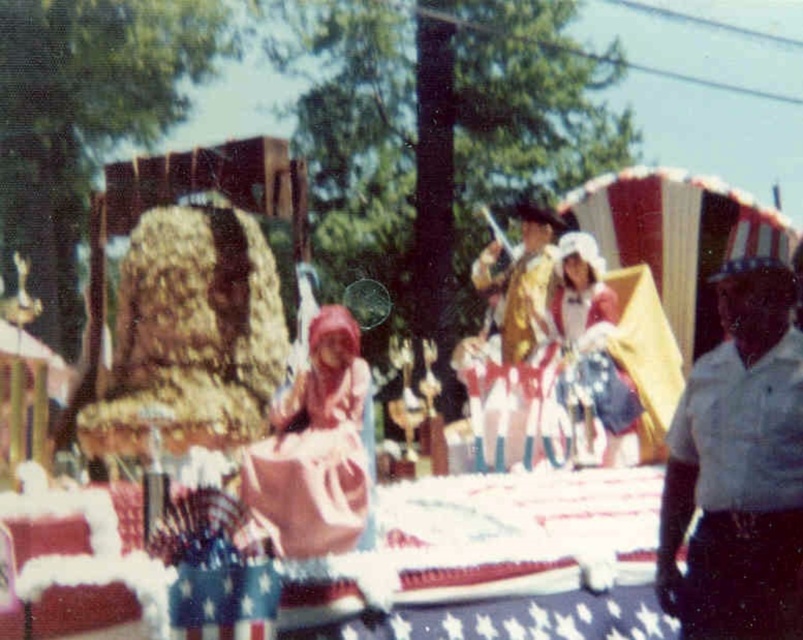
Question: Which point appears closest to the camera in this image?

Choices:
 (A) (x=321, y=470)
 (B) (x=785, y=481)
 (C) (x=520, y=312)

Answer: (B)

Question: Does gold metallic uniform at center appear on the left side of white satin dress at center?

Choices:
 (A) no
 (B) yes

Answer: (B)

Question: Does white uniform at right have a larger size compared to pink satin dress at center?

Choices:
 (A) yes
 (B) no

Answer: (B)

Question: Can you confirm if pink satin dress at center is wider than gold metallic uniform at center?

Choices:
 (A) no
 (B) yes

Answer: (B)

Question: Which of the following is the closest to the observer?

Choices:
 (A) white uniform at right
 (B) pink satin dress at center

Answer: (B)

Question: Which point appears closest to the camera in this image?

Choices:
 (A) (520, 449)
 (B) (575, 413)
 (C) (294, 496)

Answer: (C)